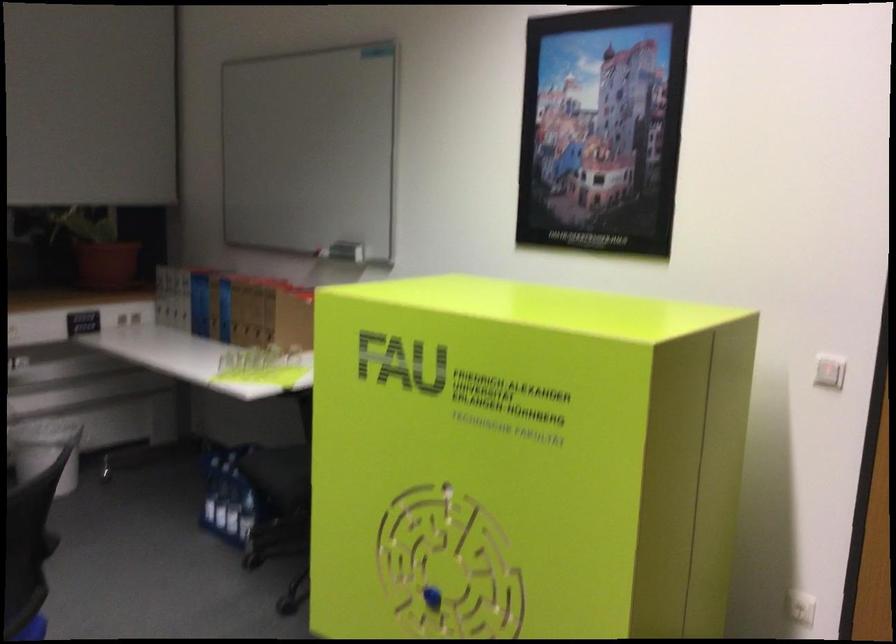
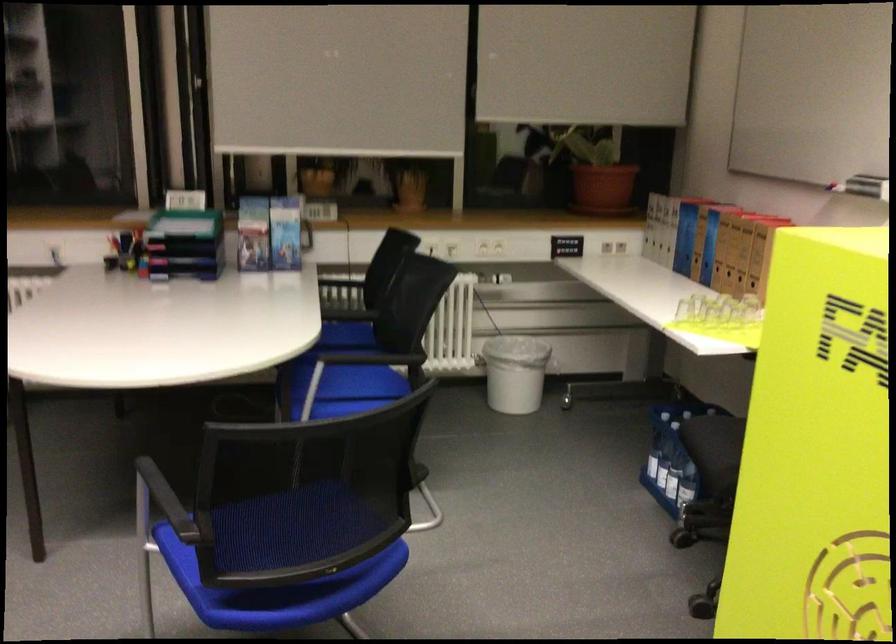
Find the pixel in the second image that matches [261,307] in the first image.

(746, 243)